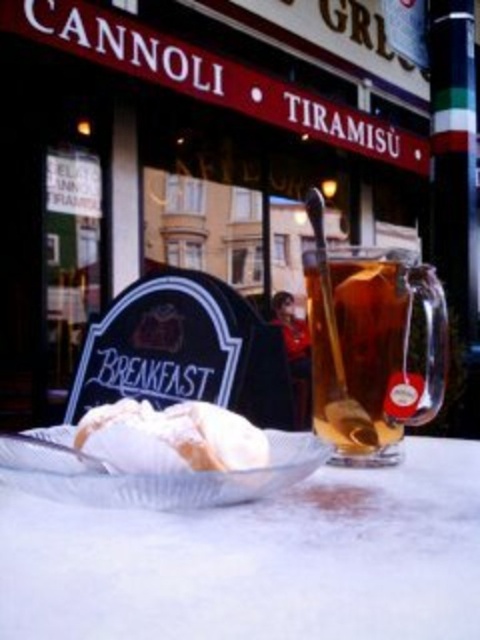
You are a customer at the cafe and want to pour the liquid from the translucent glass carafe at center into the cup with the white powdered sugar at center. Will the carafe fit over the cup?

The translucent glass carafe at center is taller than white powdered sugar at center, so yes, the carafe can fit over the cup with the white powdered sugar at center since it is taller.

You are a customer at the cafe and want to place your phone on the surface closest to you. Which object between the white glossy table at center and the translucent glass carafe at center should you choose?

The white glossy table at center is shorter than the translucent glass carafe at center, so the table is lower. Therefore, the surface closest to you would be the white glossy table at center.

You are a barista preparing a drink and need to reach for the translucent glass carafe at center and the white powdered sugar at center. The space between them is narrow. Can you fit your hand between them without knocking either over?

The translucent glass carafe at center and white powdered sugar at center are 5.88 inches apart, so yes, you can fit your hand between them as the space is sufficient for a hand to pass through without knocking either over.